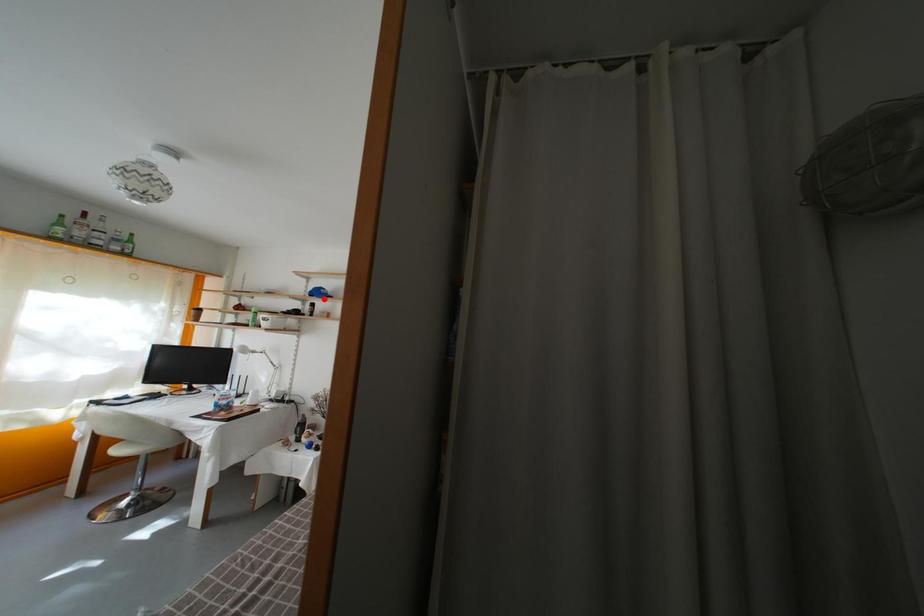
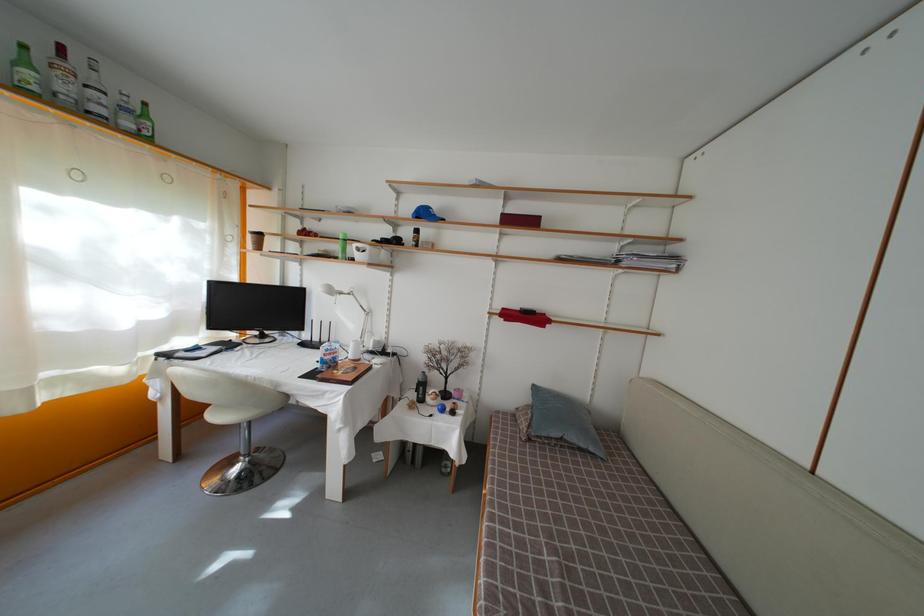
Where in the second image is the point corresponding to the highlighted location from the first image?

(430, 220)